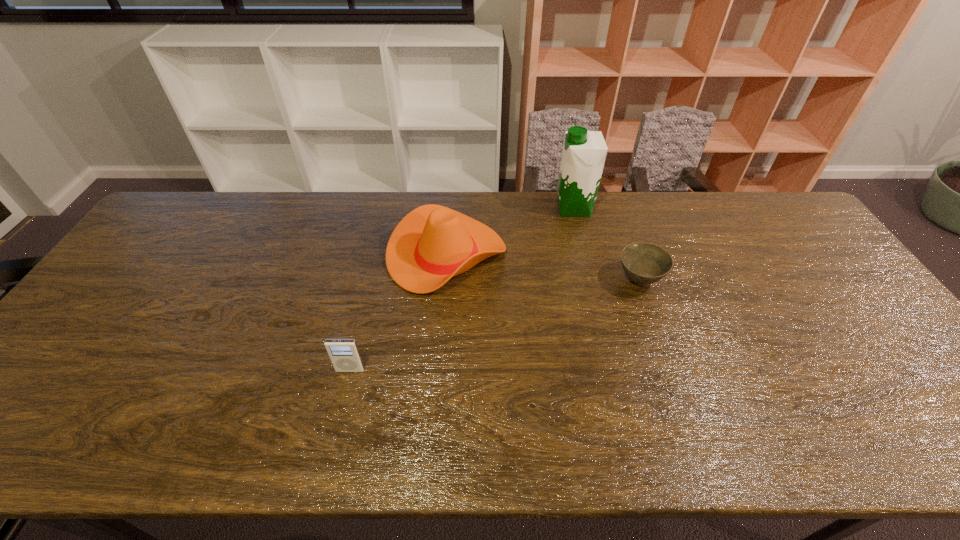
This screenshot has height=540, width=960. I want to click on object that is the third closest to the tallest object, so click(x=344, y=354).

You are a GUI agent. You are given a task and a screenshot of the screen. Output one action in this format:
    pyautogui.click(x=<x>, y=<y>)
    Task: Click on the free space that satisfies the following two spatial constraints: 1. on the front-facing side of the second object from right to left; 2. on the back side of the bowl
    The width and height of the screenshot is (960, 540).
    Given the screenshot: What is the action you would take?
    pyautogui.click(x=591, y=280)

Identify the location of vacant position in the image that satisfies the following two spatial constraints: 1. on the front-facing side of the second object from right to left; 2. on the right side of the bowl. (591, 280).